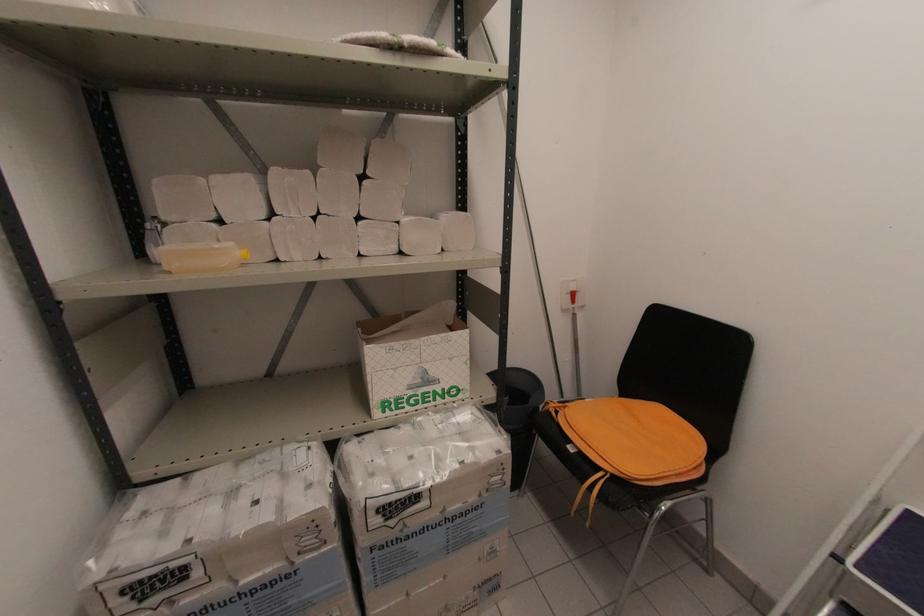
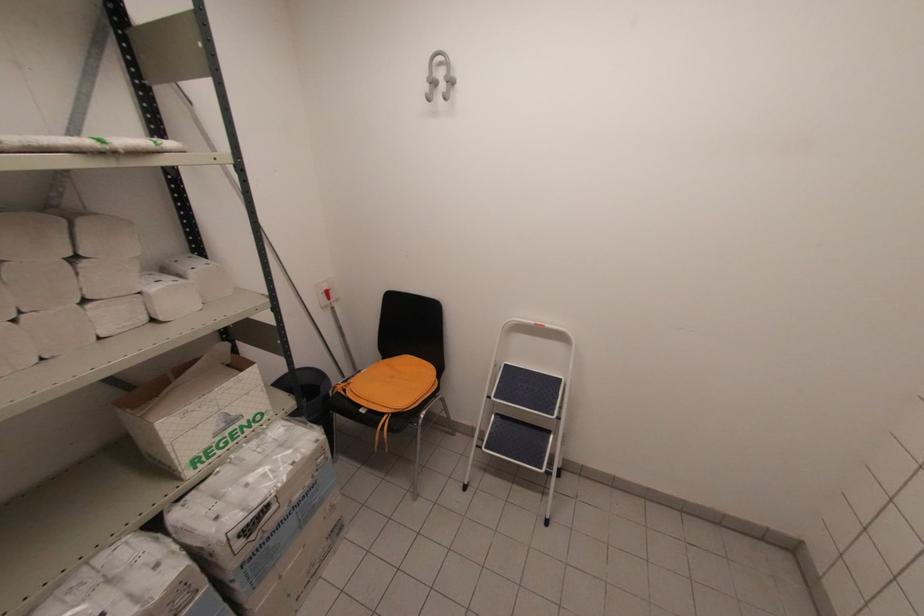
The point at [512,453] is marked in the first image. Where is the corresponding point in the second image?

(325, 437)